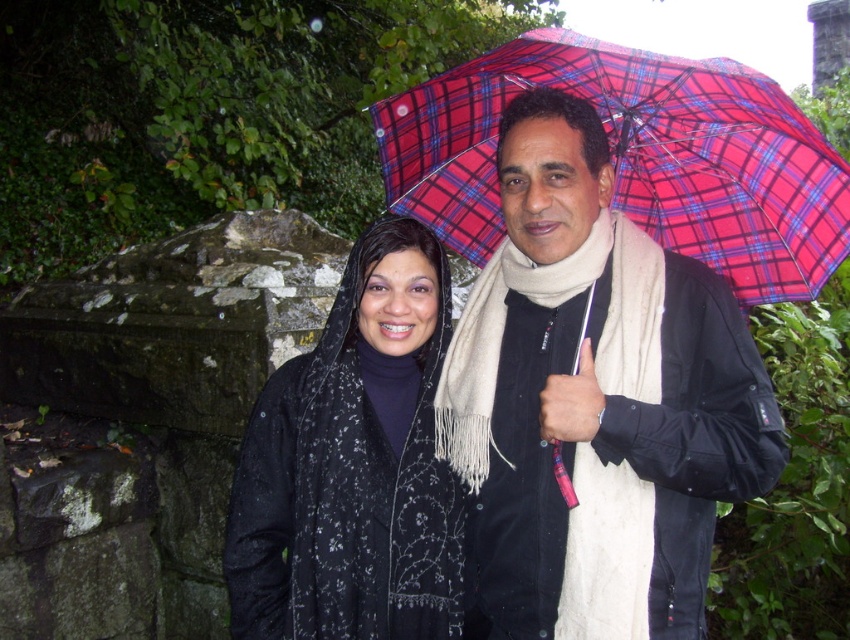
Question: Does matte black jacket at center appear on the left side of black textured scarf at center?

Choices:
 (A) no
 (B) yes

Answer: (A)

Question: Which object is farther from the camera taking this photo?

Choices:
 (A) black textured scarf at center
 (B) plaid fabric umbrella at upper center

Answer: (A)

Question: Among these points, which one is nearest to the camera?

Choices:
 (A) (491, 536)
 (B) (468, 253)

Answer: (A)

Question: Does matte black jacket at center appear on the left side of black textured scarf at center?

Choices:
 (A) no
 (B) yes

Answer: (A)

Question: Which point appears farthest from the camera in this image?

Choices:
 (A) (287, 467)
 (B) (619, 456)
 (C) (496, 218)

Answer: (C)

Question: Can you confirm if matte black jacket at center is wider than black textured scarf at center?

Choices:
 (A) yes
 (B) no

Answer: (A)